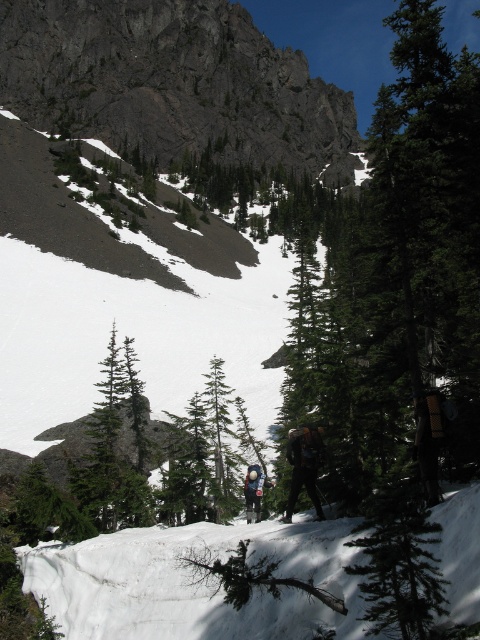
Question: Which object is positioned closest to the green textured tree at center?

Choices:
 (A) blue fabric backpack at center
 (B) rugged granite mountain at upper center

Answer: (A)

Question: Can you confirm if rugged granite mountain at upper center is positioned to the left of dark green fabric jacket at center?

Choices:
 (A) no
 (B) yes

Answer: (B)

Question: Among these points, which one is nearest to the camera?

Choices:
 (A) pyautogui.click(x=298, y=429)
 (B) pyautogui.click(x=16, y=29)
 (C) pyautogui.click(x=256, y=492)
 (D) pyautogui.click(x=402, y=554)

Answer: (D)

Question: Which point is closer to the camera?

Choices:
 (A) (290, 451)
 (B) (259, 476)

Answer: (A)

Question: Can you confirm if green textured tree at center is wider than dark green fabric jacket at center?

Choices:
 (A) yes
 (B) no

Answer: (A)

Question: Is green textured tree at center to the left of blue fabric backpack at center from the viewer's perspective?

Choices:
 (A) no
 (B) yes

Answer: (A)